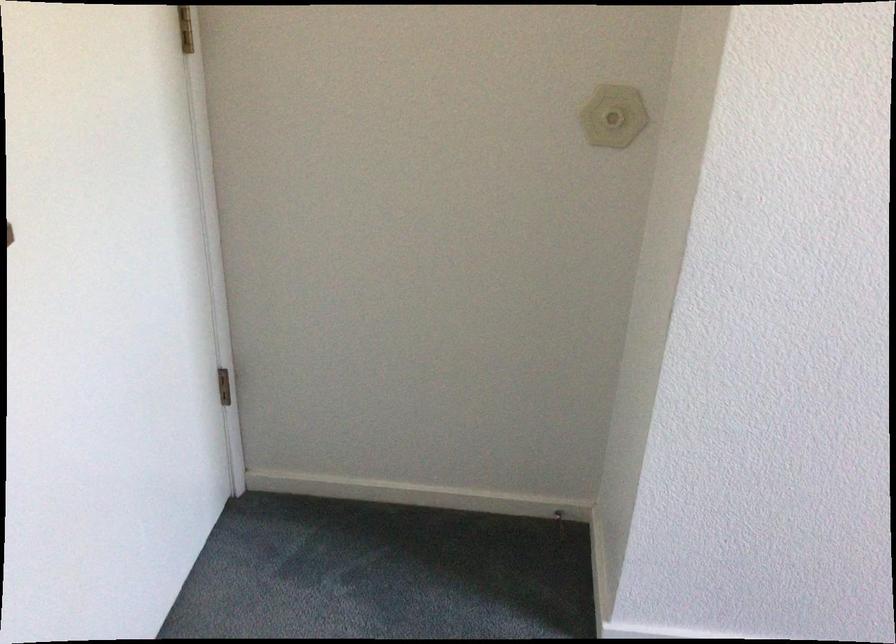
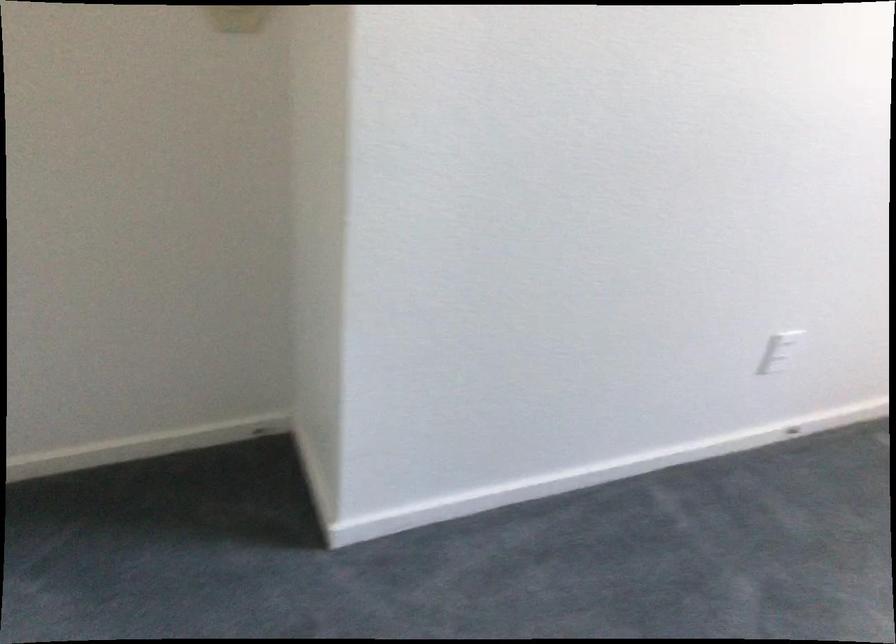
Question: The images are taken continuously from a first-person perspective. In which direction are you moving?

Choices:
 (A) Left
 (B) Right
 (C) Forward
 (D) Backward

Answer: (C)